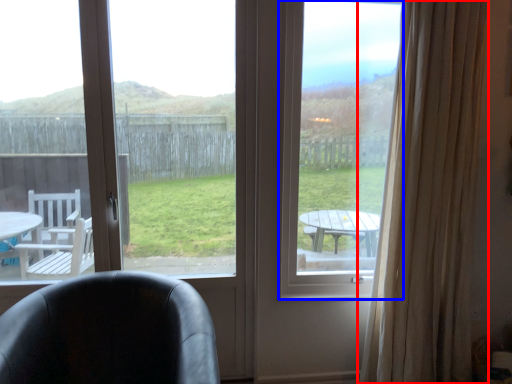
Question: Which object is closer to the camera taking this photo, curtain (highlighted by a red box) or window screen (highlighted by a blue box)?

Choices:
 (A) curtain
 (B) window screen

Answer: (A)